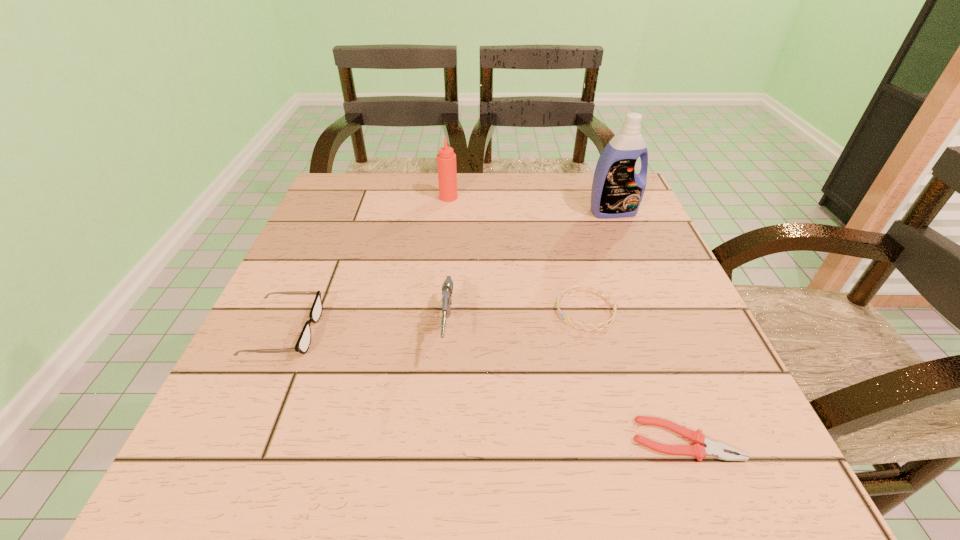
At what (x,y) coordinates should I click in order to perform the action: click on detergent. Please return your answer as a coordinate pair (x, y). Looking at the image, I should click on (617, 191).

Locate an element on the screen. This screenshot has width=960, height=540. the fifth nearest object is located at coordinates (617, 191).

You are a GUI agent. You are given a task and a screenshot of the screen. Output one action in this format:
    pyautogui.click(x=<x>, y=<y>)
    Task: Click on the fifth shortest object
    This screenshot has height=540, width=960.
    Given the screenshot: What is the action you would take?
    446,159

You are a GUI agent. You are given a task and a screenshot of the screen. Output one action in this format:
    pyautogui.click(x=<x>, y=<y>)
    Task: Click on the Tabasco sauce
    The width and height of the screenshot is (960, 540).
    Given the screenshot: What is the action you would take?
    (x=446, y=159)

Image resolution: width=960 pixels, height=540 pixels. In order to click on the third tallest object in this screenshot , I will do `click(447, 288)`.

Find the location of `the leftmost object`. the leftmost object is located at coordinates (303, 343).

Where is `spectacles`? This screenshot has height=540, width=960. spectacles is located at coordinates (303, 343).

I want to click on the second shortest object, so click(568, 290).

Locate an element on the screen. The width and height of the screenshot is (960, 540). pliers is located at coordinates (716, 449).

Locate an element on the screen. The height and width of the screenshot is (540, 960). the shortest object is located at coordinates (716, 449).